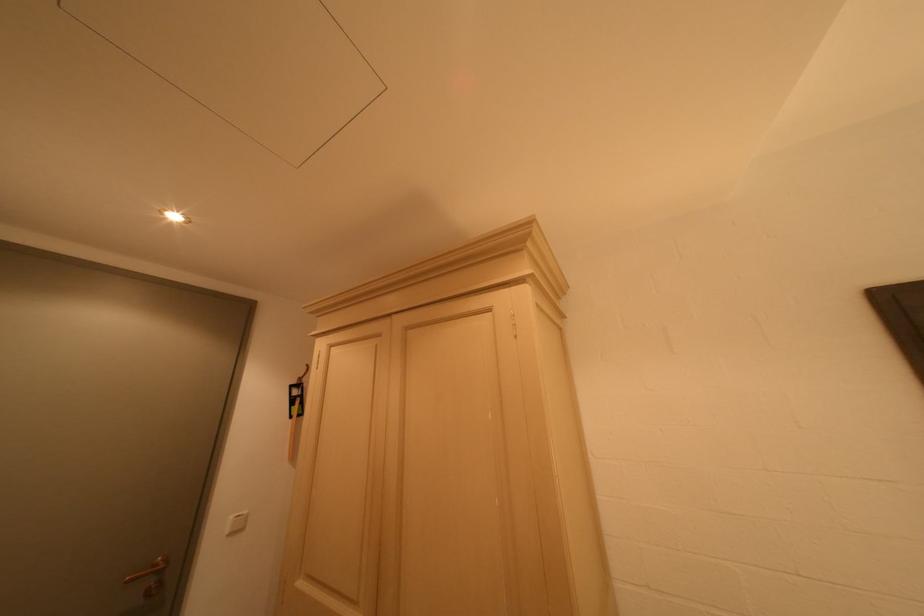
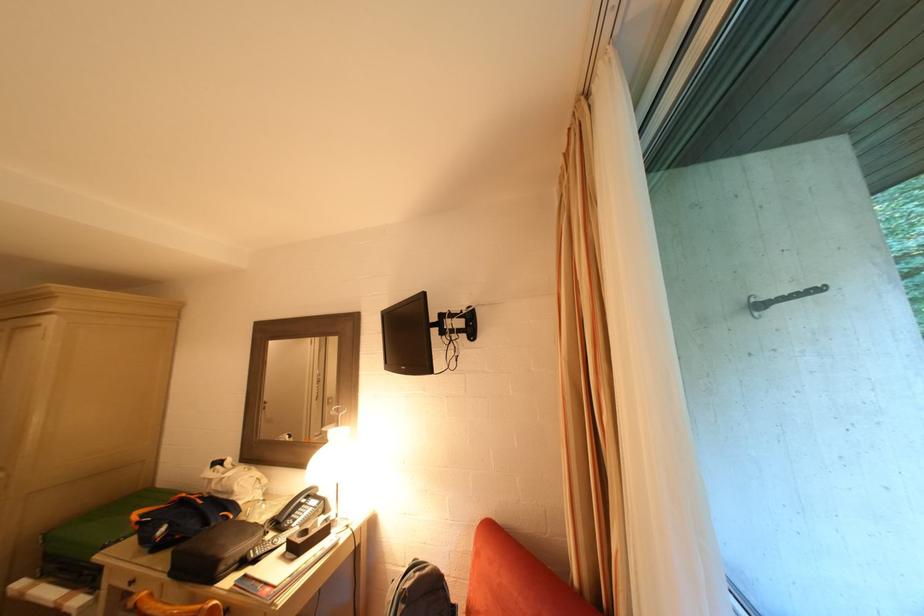
The images are taken continuously from a first-person perspective. In which direction are you moving?

The cameraman moved toward right, backward.